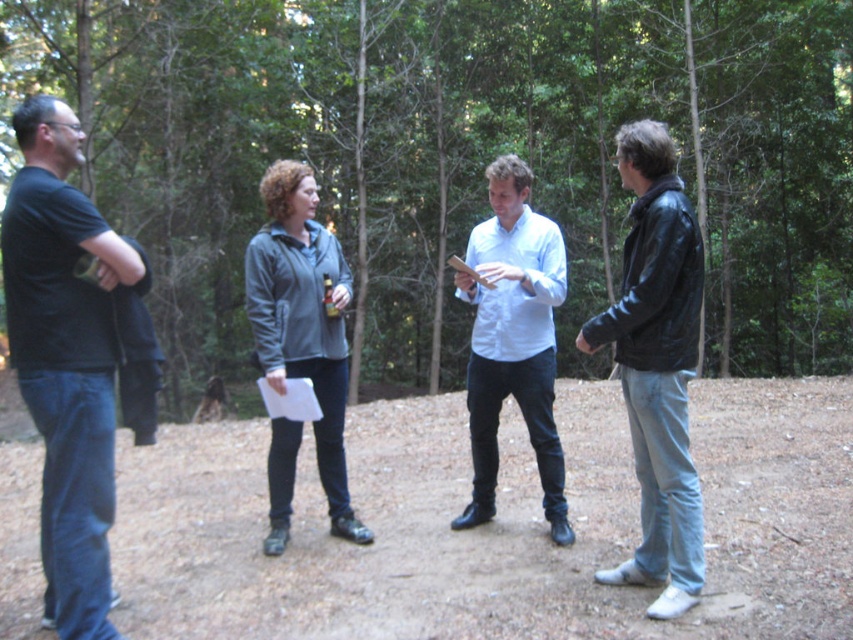
Is brown dirt ground at center positioned behind black leather jacket at right?

No, brown dirt ground at center is in front of black leather jacket at right.

Does brown dirt ground at center appear under black leather jacket at right?

Actually, brown dirt ground at center is above black leather jacket at right.

Between point (415, 40) and point (683, 492), which one is positioned in front?

Positioned in front is point (683, 492).

Locate an element on the screen. brown dirt ground at center is located at coordinates 456,156.

Who is lower down, brown dirt ground at center or light blue shirt at center?

light blue shirt at center is below.

Does brown dirt ground at center have a lesser height compared to light blue shirt at center?

No, brown dirt ground at center is not shorter than light blue shirt at center.

Where is `brown dirt ground at center`? This screenshot has height=640, width=853. brown dirt ground at center is located at coordinates (456, 156).

Is black matte t-shirt at left positioned behind black leather jacket at right?

That is False.

Which is in front, point (102, 621) or point (677, 241)?

Positioned in front is point (102, 621).

The image size is (853, 640). Identify the location of black matte t-shirt at left. (65, 358).